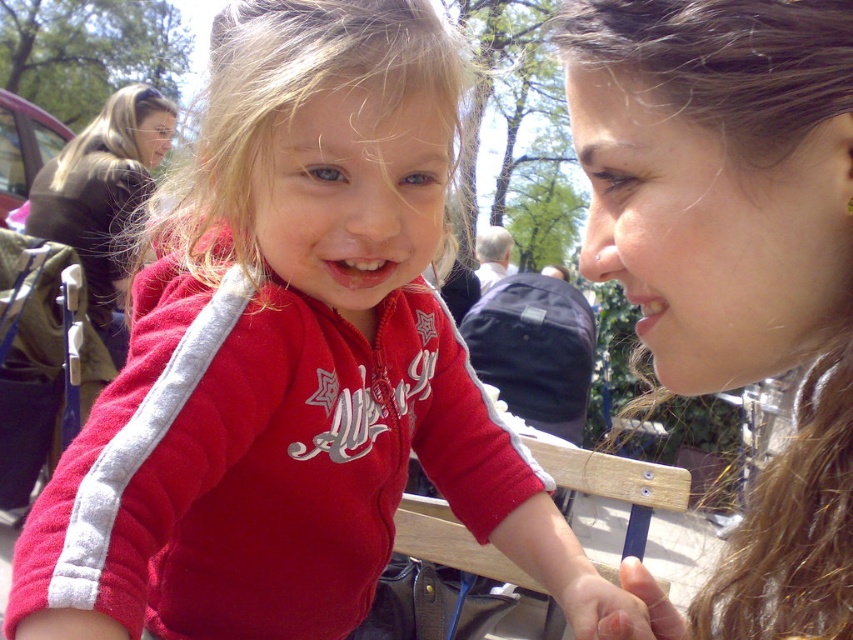
Describe the element at coordinates (712, 230) in the screenshot. I see `smooth skin face at upper right` at that location.

Identify the location of smooth skin face at upper right. (712, 230).

Is smooth brown hair at center positioned before matte skin face at upper left?

Yes, it is in front of matte skin face at upper left.

Can you confirm if smooth brown hair at center is positioned to the left of matte skin face at upper left?

Incorrect, smooth brown hair at center is not on the left side of matte skin face at upper left.

At what (x,y) coordinates should I click in order to perform the action: click on smooth brown hair at center. Please return your answer as a coordinate pair (x, y). The width and height of the screenshot is (853, 640). Looking at the image, I should click on (733, 262).

Which is more to the right, smooth brown hair at center or smooth skin face at upper right?

smooth brown hair at center

Who is shorter, smooth brown hair at center or smooth skin face at upper right?

With less height is smooth skin face at upper right.

Does point (753, 353) come farther from viewer compared to point (799, 188)?

Yes, point (753, 353) is farther from viewer.

Locate an element on the screen. smooth brown hair at center is located at coordinates (733, 262).